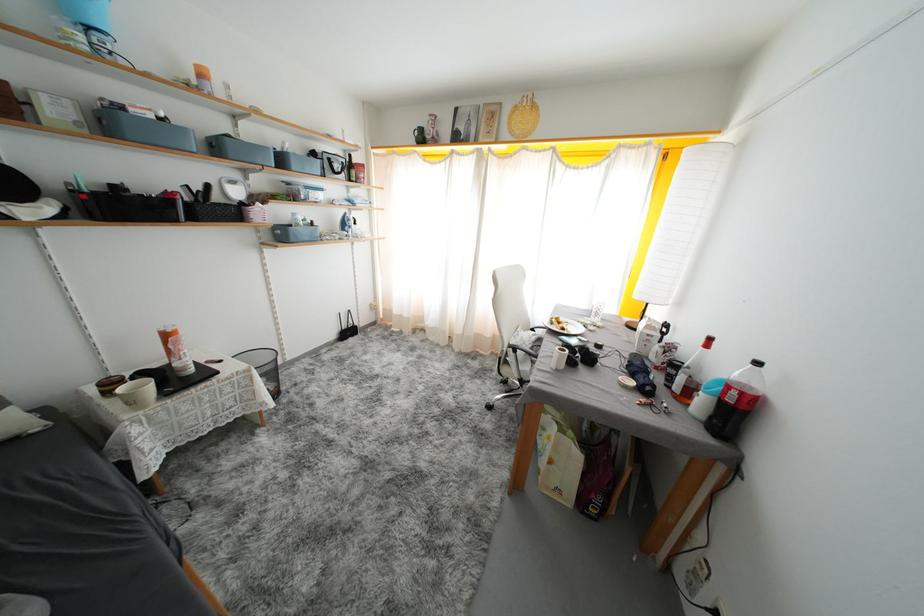
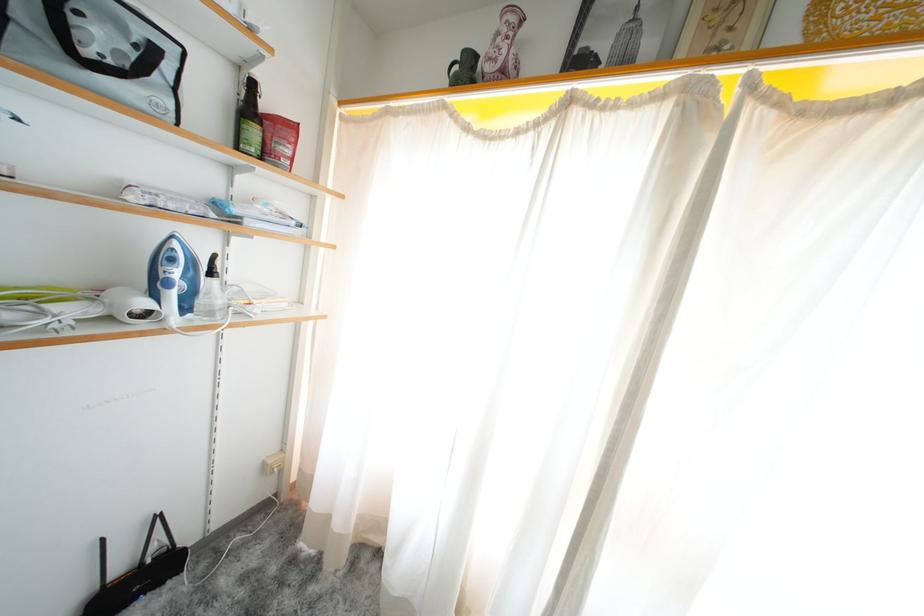
Where in the second image is the point corresponding to the point at 359,177 from the first image?

(261, 137)